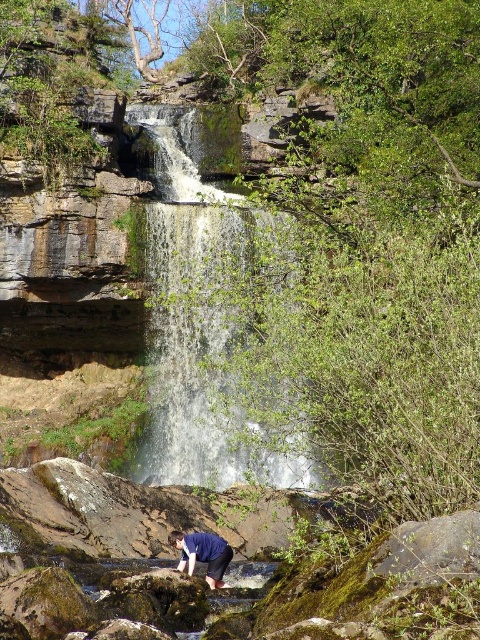
Question: In this image, where is white frothy water at center located relative to blue fabric shirt at lower center?

Choices:
 (A) below
 (B) above

Answer: (B)

Question: Is white frothy water at center smaller than blue fabric shirt at lower center?

Choices:
 (A) no
 (B) yes

Answer: (A)

Question: Can you confirm if white frothy water at center is positioned to the left of blue fabric shirt at lower center?

Choices:
 (A) yes
 (B) no

Answer: (A)

Question: Which object appears closest to the camera in this image?

Choices:
 (A) blue fabric shirt at lower center
 (B) white frothy water at center

Answer: (B)

Question: Which object is closer to the camera taking this photo?

Choices:
 (A) white frothy water at center
 (B) blue fabric shirt at lower center

Answer: (A)